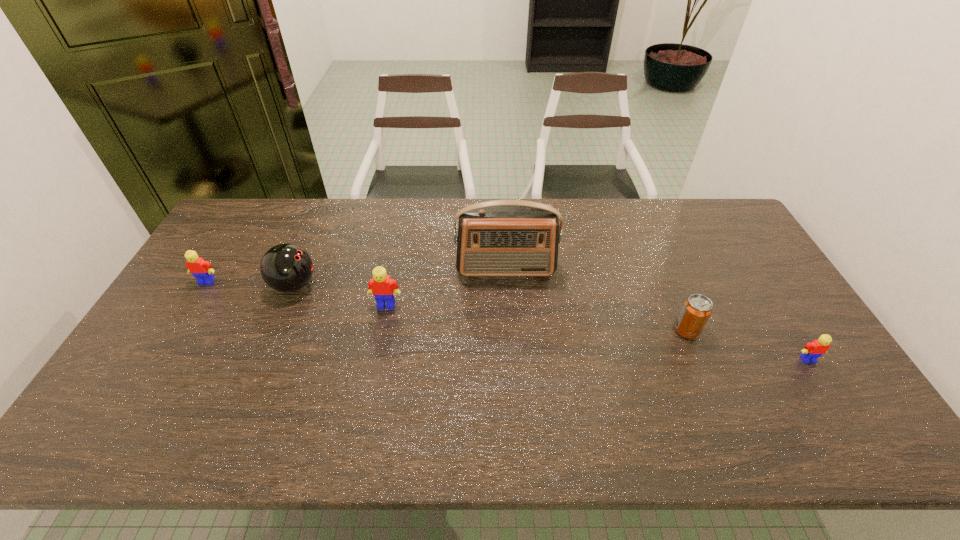
Where is `the leftmost Lego`? This screenshot has height=540, width=960. the leftmost Lego is located at coordinates (201, 269).

Where is `the farthest Lego`? This screenshot has height=540, width=960. the farthest Lego is located at coordinates (x=201, y=269).

You are a GUI agent. You are given a task and a screenshot of the screen. Output one action in this format:
    pyautogui.click(x=<x>, y=<y>)
    Task: Click on the tallest Lego
    The width and height of the screenshot is (960, 540).
    Given the screenshot: What is the action you would take?
    pyautogui.click(x=381, y=286)

Locate an element on the screen. The width and height of the screenshot is (960, 540). the fourth object from right to left is located at coordinates (381, 286).

At what (x,y) coordinates should I click in order to perform the action: click on the rightmost Lego. Please return your answer as a coordinate pair (x, y). The width and height of the screenshot is (960, 540). Looking at the image, I should click on (812, 351).

You are a GUI agent. You are given a task and a screenshot of the screen. Output one action in this format:
    pyautogui.click(x=<x>, y=<y>)
    Task: Click on the nearest object
    
    Given the screenshot: What is the action you would take?
    pyautogui.click(x=812, y=351)

The height and width of the screenshot is (540, 960). In order to click on the fifth farthest object in this screenshot , I will do `click(696, 310)`.

Where is `soda can`? The height and width of the screenshot is (540, 960). soda can is located at coordinates (696, 310).

Find the location of a particular element. The width and height of the screenshot is (960, 540). the tallest object is located at coordinates (509, 237).

Find the location of a particular element. the fourth object from left to right is located at coordinates (509, 237).